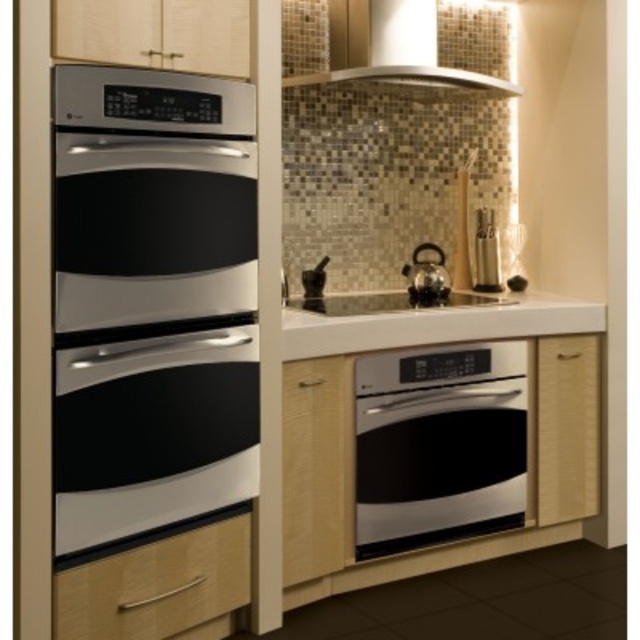
You are standing in the modern kitchen described. You need to place a small plant between the two points labeled point (97, 412) and point (148, 614). Which point should the plant be closer to if it needs to be placed in front of the other point?

The plant should be placed closer to point (97, 412) because it is in front of point (148, 614).

You are a chef standing at the center of the kitchen. You need to reach the matte black oven at left to adjust the temperature. Based on its position, which direction should you move to reach it?

The matte black oven at left is located at point (152,433), so you should move to the left to reach it.